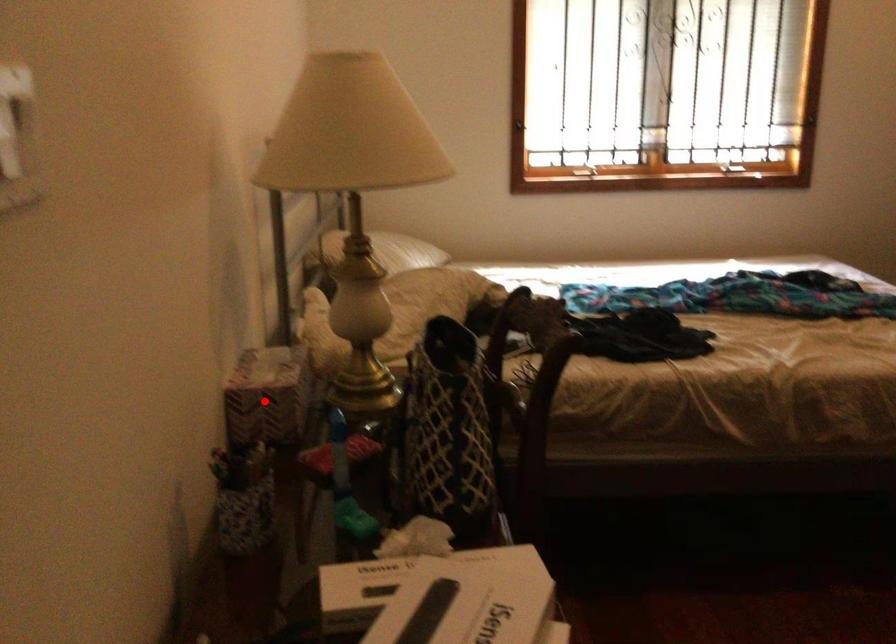
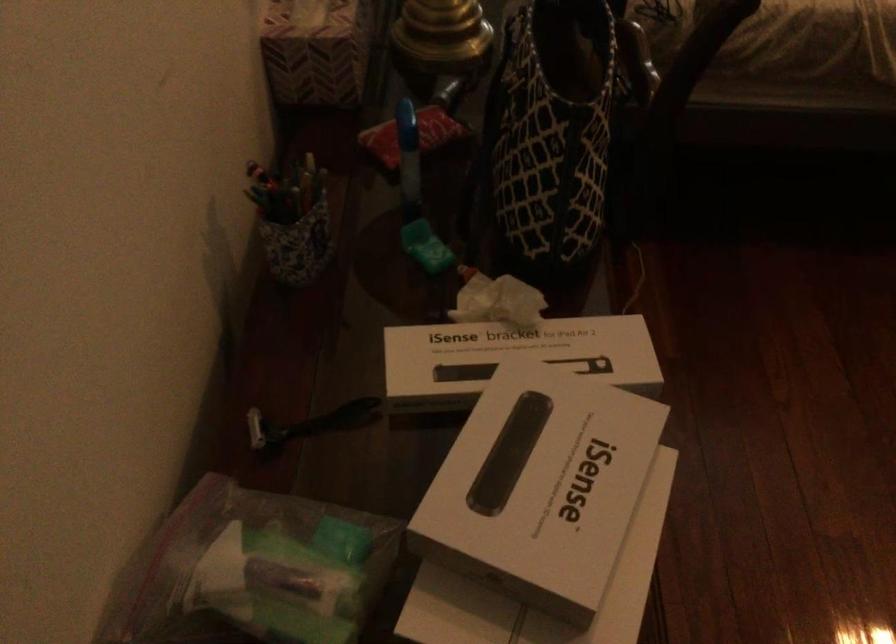
Question: I am providing you with two images of the same scene from different viewpoints. Image1 has a red point marked. In image2, the corresponding 3D location appears at what relative position? Reply with the corresponding letter.

Choices:
 (A) Closer
 (B) Farther

Answer: (A)